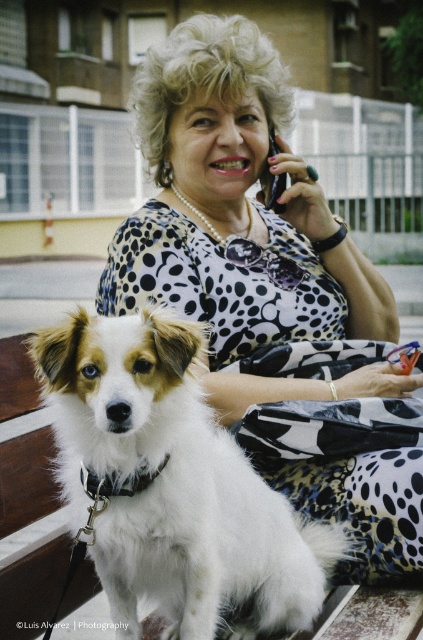
Question: Can you confirm if floral-patterned blouse at center is wider than white fluffy dog at center?

Choices:
 (A) yes
 (B) no

Answer: (A)

Question: Where is floral-patterned blouse at center located in relation to white fluffy dog at center in the image?

Choices:
 (A) right
 (B) left

Answer: (A)

Question: Which object is closer to the camera taking this photo?

Choices:
 (A) floral-patterned blouse at center
 (B) white fluffy dog at center

Answer: (B)

Question: Does floral-patterned blouse at center lie in front of white fluffy dog at center?

Choices:
 (A) no
 (B) yes

Answer: (A)